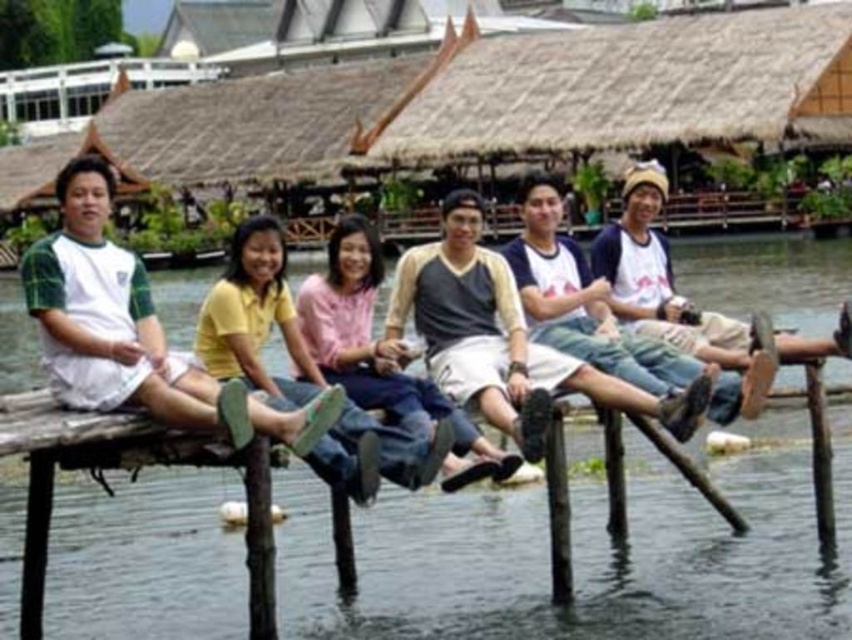
You are a photographer standing on the wooden pier. You want to capture a photo of the clear blue water at center and the yellow matte shirt at center. Which object should you focus on first if you want to ensure both are in sharp focus?

The clear blue water at center is above the yellow matte shirt at center, so you should focus on the yellow matte shirt at center first to ensure both are in sharp focus.

You are a photographer standing on the wooden pier. You want to take a photo of the clear blue water at center and the yellow matte shirt at center. Which object should you focus on first if you want to ensure both are in focus?

The clear blue water at center is further to the viewer than the yellow matte shirt at center. To ensure both are in focus, you should focus on the yellow matte shirt at center first since it is closer, as depth of field extends behind the point of focus.